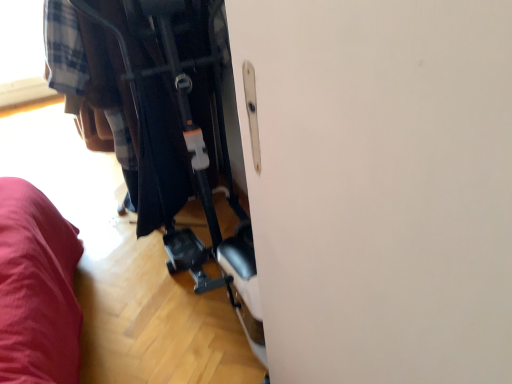
The height and width of the screenshot is (384, 512). What are the coordinates of `vacant space underneath metallic black baby carriage at center (from a real-world perspective)` in the screenshot? It's located at (212, 315).